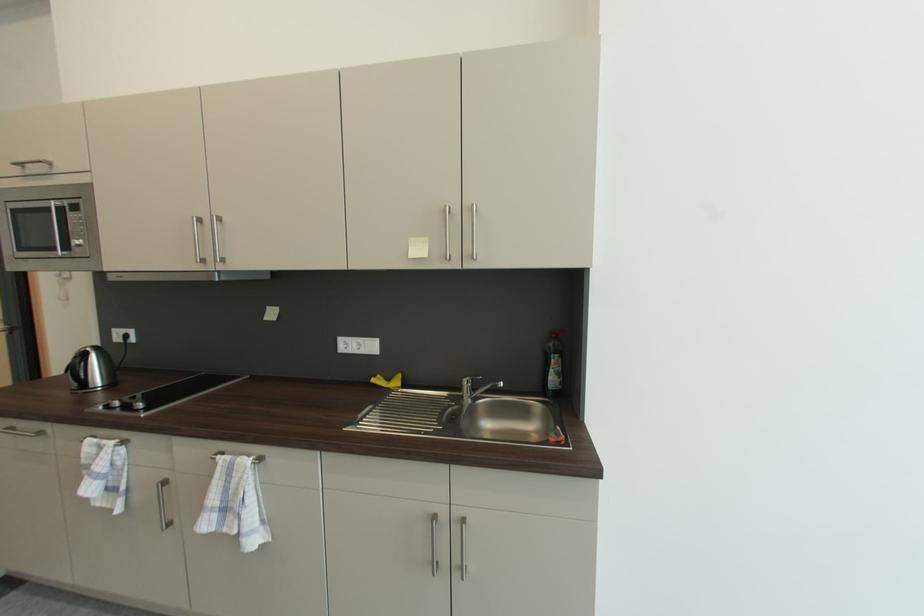
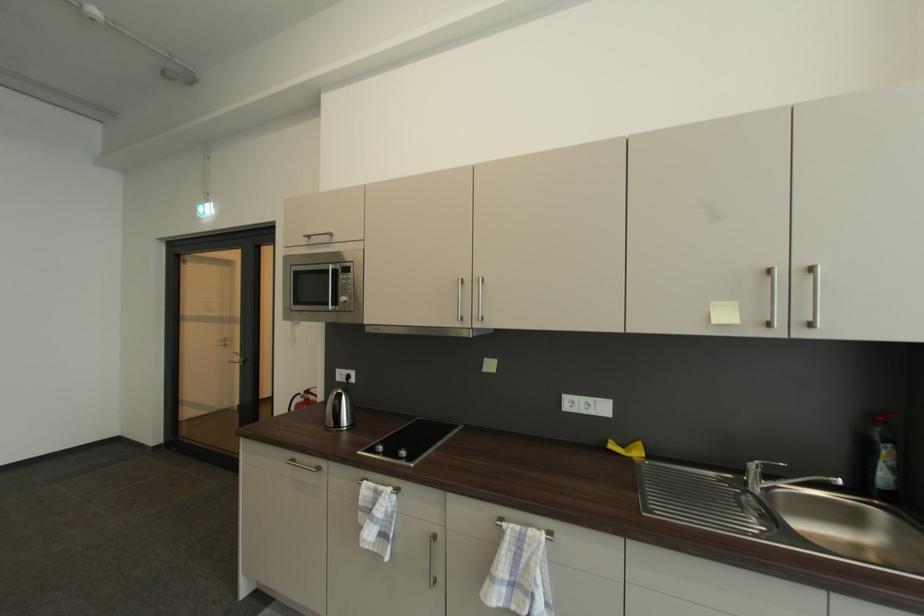
Question: The camera is either moving clockwise (left) or counter-clockwise (right) around the object. The first image is from the beginning of the video and the second image is from the end. Is the camera moving left or right when shooting the video?

Choices:
 (A) Left
 (B) Right

Answer: (B)